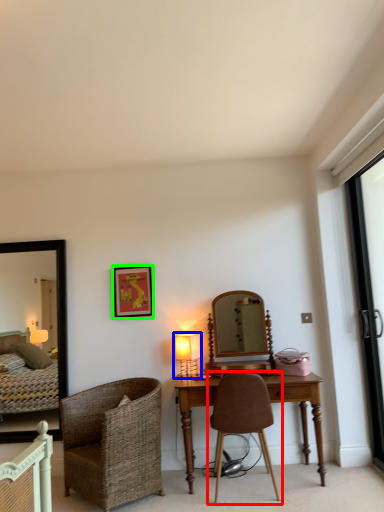
Question: Based on their relative distances, which object is nearer to chair (highlighted by a red box)? Choose from table lamp (highlighted by a blue box) and picture frame (highlighted by a green box).

Choices:
 (A) table lamp
 (B) picture frame

Answer: (A)